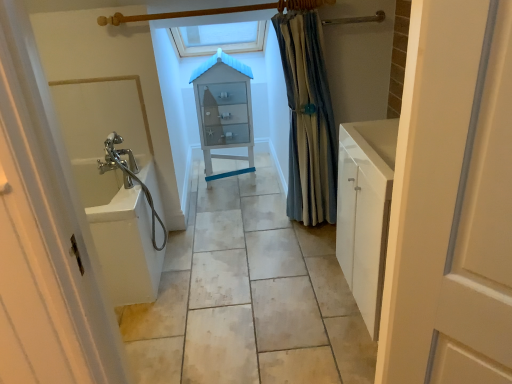
Question: Is translucent glass cabinet at center aimed at blue striped fabric at right?

Choices:
 (A) no
 (B) yes

Answer: (A)

Question: From a real-world perspective, is translucent glass cabinet at center positioned over blue striped fabric at right based on gravity?

Choices:
 (A) no
 (B) yes

Answer: (A)

Question: From a real-world perspective, does translucent glass cabinet at center sit lower than blue striped fabric at right?

Choices:
 (A) no
 (B) yes

Answer: (B)

Question: Is translucent glass cabinet at center to the left of blue striped fabric at right from the viewer's perspective?

Choices:
 (A) no
 (B) yes

Answer: (B)

Question: Can we say translucent glass cabinet at center lies outside blue striped fabric at right?

Choices:
 (A) yes
 (B) no

Answer: (A)

Question: Is white glossy sink at left wider or thinner than blue striped fabric at right?

Choices:
 (A) wide
 (B) thin

Answer: (A)

Question: Considering their positions, is white glossy sink at left located in front of or behind blue striped fabric at right?

Choices:
 (A) front
 (B) behind

Answer: (A)

Question: Is point coord(212,299) closer or farther from the camera than point coord(289,64)?

Choices:
 (A) farther
 (B) closer

Answer: (B)

Question: Choose the correct answer: Is white glossy sink at left inside blue striped fabric at right or outside it?

Choices:
 (A) inside
 (B) outside

Answer: (B)

Question: From a real-world perspective, is white glossy bath at left above or below blue striped fabric at right?

Choices:
 (A) above
 (B) below

Answer: (B)

Question: In terms of width, does white glossy bath at left look wider or thinner when compared to blue striped fabric at right?

Choices:
 (A) wide
 (B) thin

Answer: (A)

Question: Is white glossy bath at left to the left or to the right of blue striped fabric at right in the image?

Choices:
 (A) right
 (B) left

Answer: (B)

Question: Which is correct: white glossy bath at left is inside blue striped fabric at right, or outside of it?

Choices:
 (A) inside
 (B) outside

Answer: (B)

Question: Would you say white glossy bath at left is to the left or to the right of white glossy sink at left in the picture?

Choices:
 (A) left
 (B) right

Answer: (A)

Question: From their relative heights in the image, would you say white glossy bath at left is taller or shorter than white glossy sink at left?

Choices:
 (A) short
 (B) tall

Answer: (B)